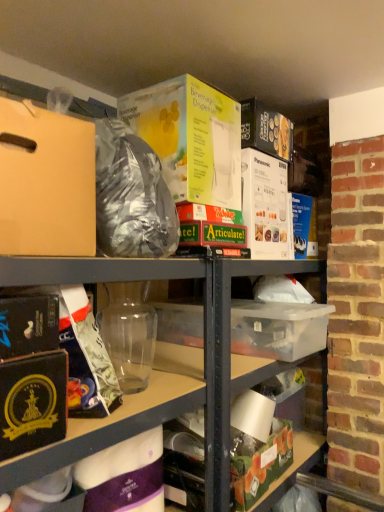
Question: Is green matte box at lower center at the back of black matte book at lower left, placed as the 2th paperback book when sorted from back to front?

Choices:
 (A) no
 (B) yes

Answer: (A)

Question: Would you say black matte book at lower left, the first paperback book positioned from the bottom, contains green matte box at lower center?

Choices:
 (A) yes
 (B) no

Answer: (B)

Question: Is black matte book at lower left, placed as the 2th paperback book when sorted from back to front, to the right of green matte box at lower center from the viewer's perspective?

Choices:
 (A) yes
 (B) no

Answer: (B)

Question: Does black matte book at lower left, acting as the first paperback book starting from the left, lie behind green matte box at lower center?

Choices:
 (A) yes
 (B) no

Answer: (B)

Question: From a real-world perspective, does black matte book at lower left, acting as the 2th paperback book starting from the top, stand above green matte box at lower center?

Choices:
 (A) no
 (B) yes

Answer: (B)

Question: Is black matte book at lower left, which is counted as the second paperback book, starting from the right, bigger or smaller than transparent plastic container at center?

Choices:
 (A) big
 (B) small

Answer: (B)

Question: Considering the relative positions of black matte book at lower left, which is the 1th paperback book from front to back, and transparent plastic container at center in the image provided, is black matte book at lower left, which is the 1th paperback book from front to back, to the left or to the right of transparent plastic container at center?

Choices:
 (A) left
 (B) right

Answer: (A)

Question: Do you think black matte book at lower left, which is counted as the second paperback book, starting from the right, is within transparent plastic container at center, or outside of it?

Choices:
 (A) outside
 (B) inside

Answer: (A)

Question: In terms of height, does black matte book at lower left, placed as the 2th paperback book when sorted from back to front, look taller or shorter compared to transparent plastic container at center?

Choices:
 (A) short
 (B) tall

Answer: (A)

Question: Looking at the image, does purple matte wrapping paper at lower center, which is the 1th wrapping paper in bottom-to-top order, seem bigger or smaller compared to black matte book at lower left, acting as the 2th paperback book starting from the top?

Choices:
 (A) big
 (B) small

Answer: (A)

Question: From a real-world perspective, is purple matte wrapping paper at lower center, which is the 1th wrapping paper in bottom-to-top order, positioned above or below black matte book at lower left, which is the 1th paperback book from front to back?

Choices:
 (A) below
 (B) above

Answer: (A)

Question: From the image's perspective, is purple matte wrapping paper at lower center, the 2th wrapping paper when ordered from top to bottom, above or below black matte book at lower left, placed as the 2th paperback book when sorted from back to front?

Choices:
 (A) above
 (B) below

Answer: (B)

Question: In terms of height, does purple matte wrapping paper at lower center, which is the 1th wrapping paper in bottom-to-top order, look taller or shorter compared to black matte book at lower left, which is counted as the second paperback book, starting from the right?

Choices:
 (A) tall
 (B) short

Answer: (A)

Question: Relative to matte cardboard box at upper left, is matte gold wrapping paper at left, arranged as the 1th wrapping paper when viewed from the top, in front or behind?

Choices:
 (A) front
 (B) behind

Answer: (B)

Question: Do you think matte gold wrapping paper at left, which is the second wrapping paper from bottom to top, is within matte cardboard box at upper left, or outside of it?

Choices:
 (A) inside
 (B) outside

Answer: (B)